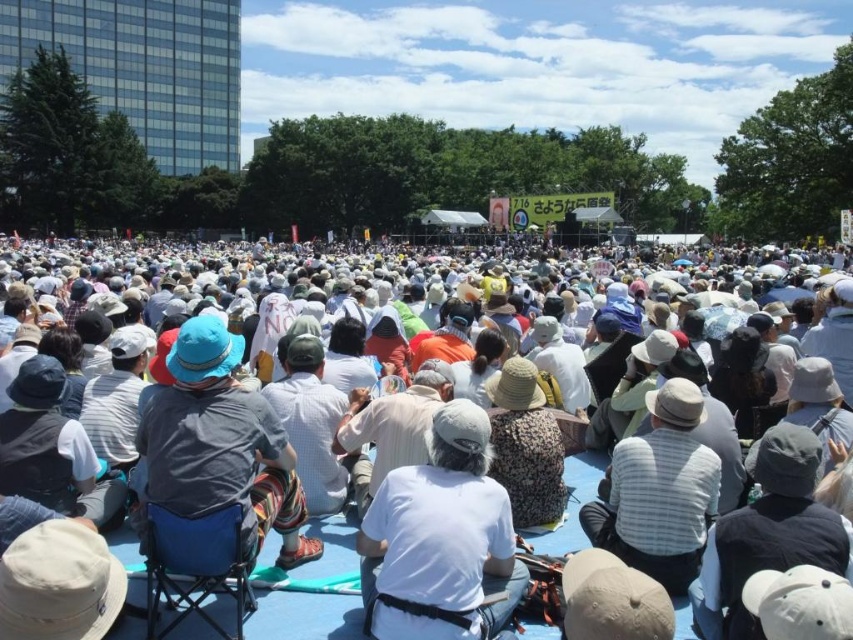
This screenshot has height=640, width=853. What do you see at coordinates (221, 444) in the screenshot?
I see `blue fabric chair at center` at bounding box center [221, 444].

Which is in front, point (254, 429) or point (679, 538)?

Positioned in front is point (679, 538).

The width and height of the screenshot is (853, 640). Find the location of `blue fabric chair at center`. blue fabric chair at center is located at coordinates (221, 444).

Who is shorter, white fabric crowd at center or striped fabric hat at center?

striped fabric hat at center is shorter.

Does point (132, 276) come farther from viewer compared to point (631, 500)?

Yes, point (132, 276) is behind point (631, 500).

You are a GUI agent. You are given a task and a screenshot of the screen. Output one action in this format:
    pyautogui.click(x=<x>, y=<y>)
    Task: Click on the white fabric crowd at center
    The image size is (853, 640).
    Given the screenshot: What is the action you would take?
    pyautogui.click(x=308, y=586)

Is white fabric at center taller than striped fabric hat at center?

Yes.

Which is more to the right, white fabric at center or striped fabric hat at center?

striped fabric hat at center

The width and height of the screenshot is (853, 640). Find the location of `white fabric at center`. white fabric at center is located at coordinates (440, 538).